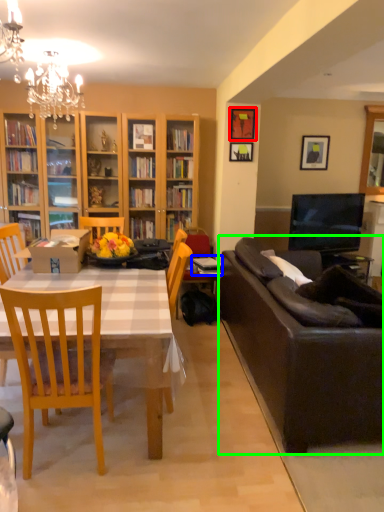
Question: Which is farther away from picture frame (highlighted by a red box)? book (highlighted by a blue box) or studio couch (highlighted by a green box)?

Choices:
 (A) book
 (B) studio couch

Answer: (B)